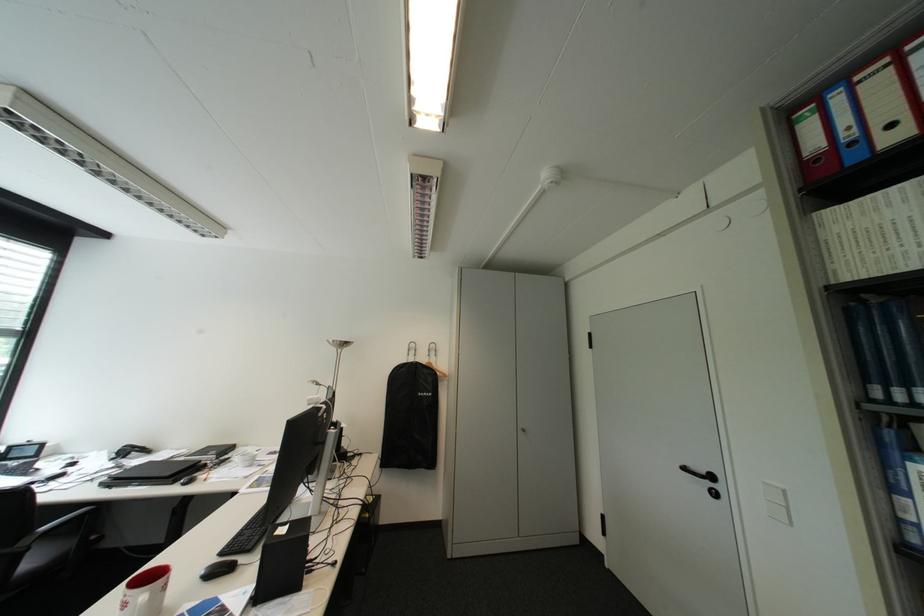
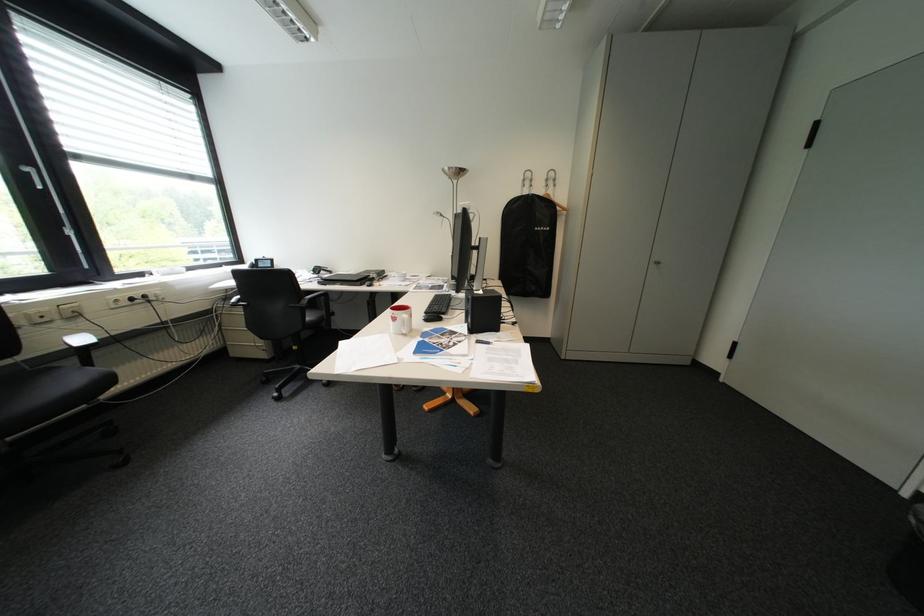
The point at (177, 586) is marked in the first image. Where is the corresponding point in the second image?

(423, 315)